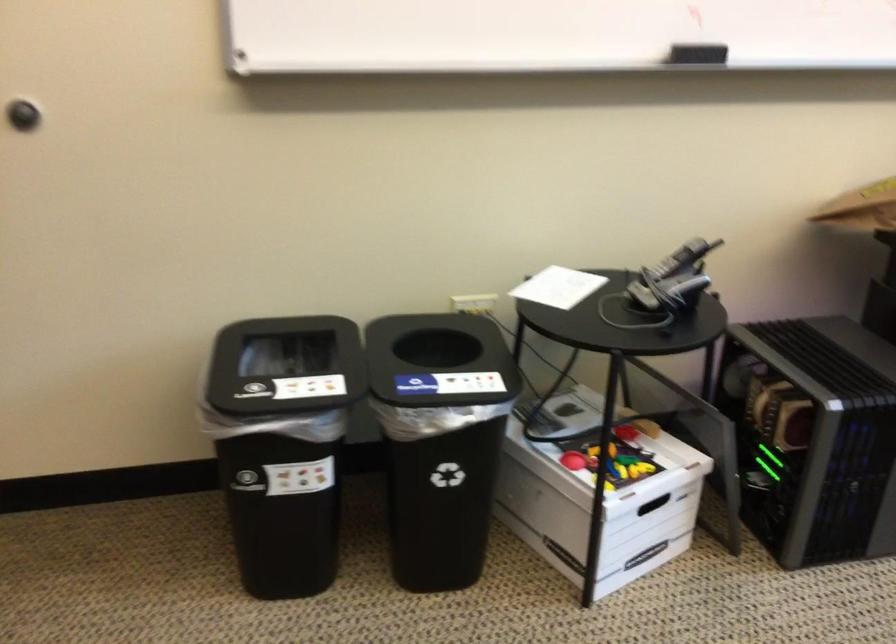
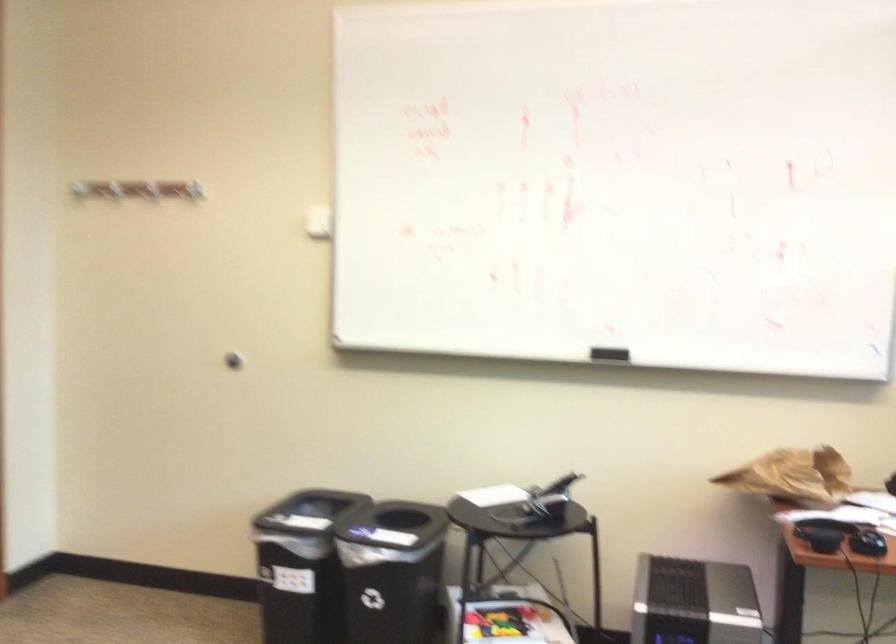
In the second image, find the point that corresponds to the point at 326,456 in the first image.

(300, 565)